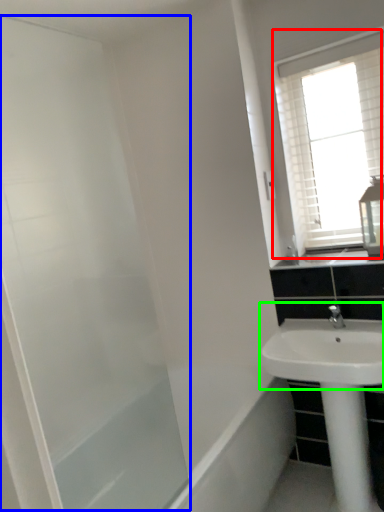
Question: Which object is positioned closest to window (highlighted by a red box)? Select from screen door (highlighted by a blue box) and sink (highlighted by a green box).

Choices:
 (A) screen door
 (B) sink

Answer: (B)